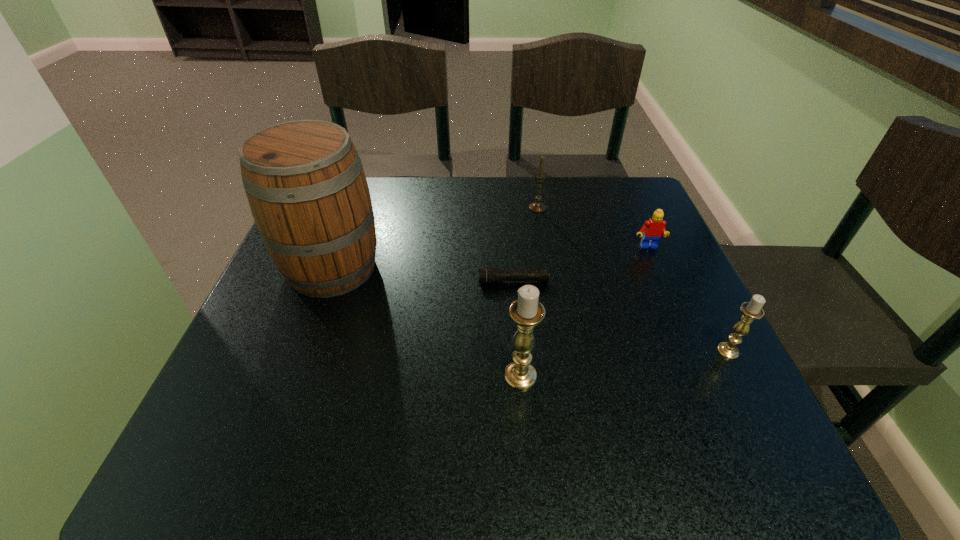
Image resolution: width=960 pixels, height=540 pixels. What are the coordinates of `free space between the fifth object from left to right and the second nearest object` in the screenshot? It's located at (687, 299).

What are the coordinates of `free area in between the tallest object and the Lego` in the screenshot? It's located at (490, 258).

You are a GUI agent. You are given a task and a screenshot of the screen. Output one action in this format:
    pyautogui.click(x=<x>, y=<y>)
    Task: Click on the free space between the right candle holder and the shortest object
    
    Given the screenshot: What is the action you would take?
    pyautogui.click(x=621, y=316)

Locate an element on the screen. The image size is (960, 540). vacant area that lies between the cider and the left candle holder is located at coordinates (426, 322).

Identify the location of object that is the closest one to the tallest object. (489, 275).

The image size is (960, 540). Identify the location of object that can be found as the fourth closest to the second object from right to left. (526, 312).

The height and width of the screenshot is (540, 960). I want to click on free region that satisfies the following two spatial constraints: 1. on the front side of the farther candle holder; 2. on the right side of the farthest object, so click(x=562, y=351).

Locate an element on the screen. The image size is (960, 540). free space that satisfies the following two spatial constraints: 1. at the lens end of the right candle holder; 2. on the left side of the shortest object is located at coordinates (519, 351).

Where is `vacant space that satisfies the following two spatial constraints: 1. on the front-facing side of the Lego; 2. at the lens end of the flashlight`? The width and height of the screenshot is (960, 540). vacant space that satisfies the following two spatial constraints: 1. on the front-facing side of the Lego; 2. at the lens end of the flashlight is located at coordinates (662, 281).

You are a GUI agent. You are given a task and a screenshot of the screen. Output one action in this format:
    pyautogui.click(x=<x>, y=<y>)
    Task: Click on the blank area in the image that satisfies the following two spatial constraints: 1. on the front side of the candle; 2. on the right side of the farther candle holder
    The height and width of the screenshot is (540, 960).
    Given the screenshot: What is the action you would take?
    [562, 351]